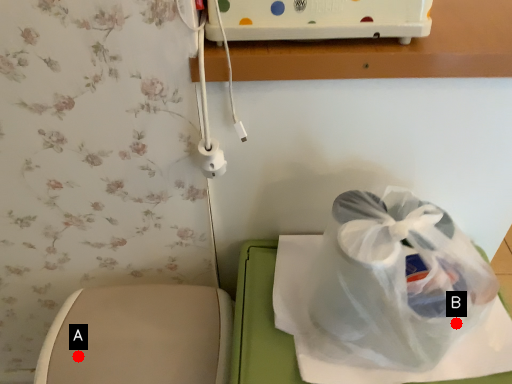
Question: Two points are circled on the image, labeled by A and B beside each circle. Which point is closer to the camera taking this photo?

Choices:
 (A) A is closer
 (B) B is closer

Answer: (B)